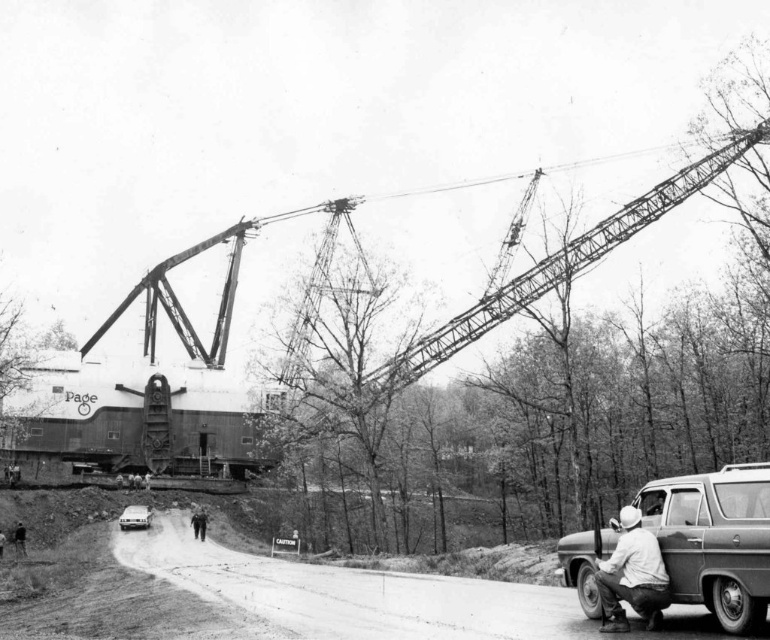
You are a safety inspector standing at the edge of the construction site. You observe the metallic trailer truck at center and the white matte shirt at lower right. Which object is located more to the left side of the scene?

The metallic trailer truck at center is positioned on the left side of white matte shirt at lower right, so the metallic trailer truck at center is more to the left.

You are a delivery driver who needs to park your truck near the construction site shown in the image. The parking area is located at point coordinates 0.844, 0.929. Is the metallic silver van at lower right blocking your parking spot?

The metallic silver van at lower right is located at point coordinates (715,540), which matches the parking area coordinates. Therefore, the metallic silver van at lower right is blocking your parking spot.

Based on the photo, you are a construction worker standing at the base of the crane. You need to place a marker at the point that is closer to you between the two points labeled point [701,538] and point [132,524]. Which point should you choose?

You should choose point [132,524] because it is behind point [701,538], meaning it is closer to your position at the base of the crane.